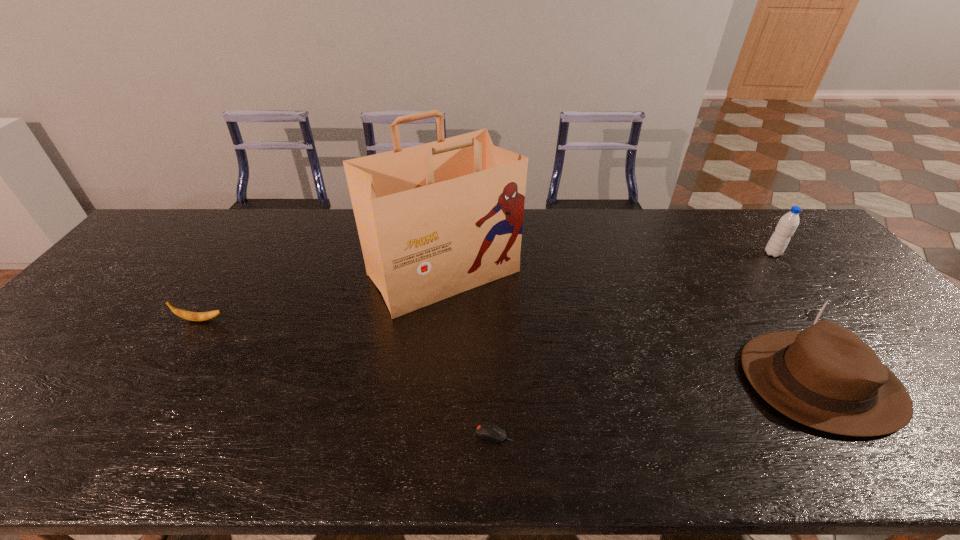
You are a GUI agent. You are given a task and a screenshot of the screen. Output one action in this format:
    pyautogui.click(x=<x>, y=<y>)
    Task: Click on the free space that satisfies the following two spatial constraints: 1. on the side of the grocery bag with the superhero design; 2. on the right side of the computer mouse
    
    Given the screenshot: What is the action you would take?
    pyautogui.click(x=428, y=434)

Locate an element on the screen. free location that satisfies the following two spatial constraints: 1. on the peel of the banana from the top; 2. on the left side of the shortest object is located at coordinates (128, 434).

Find the location of a particular element. vacant area in the image that satisfies the following two spatial constraints: 1. on the side of the tallest object with the superhero design; 2. on the peel of the second shortest object from the top is located at coordinates (440, 320).

Image resolution: width=960 pixels, height=540 pixels. I want to click on vacant position in the image that satisfies the following two spatial constraints: 1. on the side of the tallest object with the superhero design; 2. on the left side of the shortest object, so click(x=428, y=434).

What are the coordinates of `vacant region that satisfies the following two spatial constraints: 1. on the peel of the banana from the top; 2. on the back side of the shortest object` in the screenshot? It's located at (128, 434).